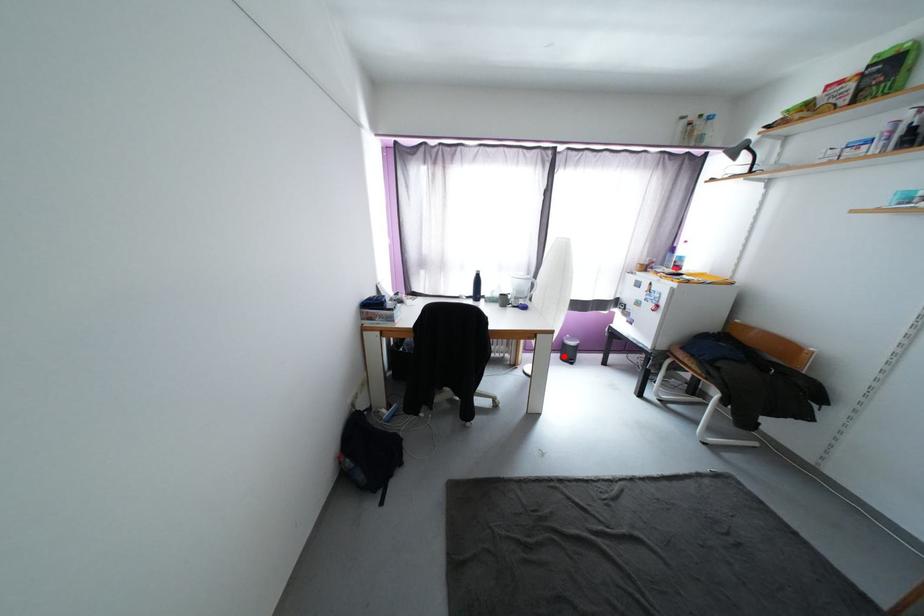
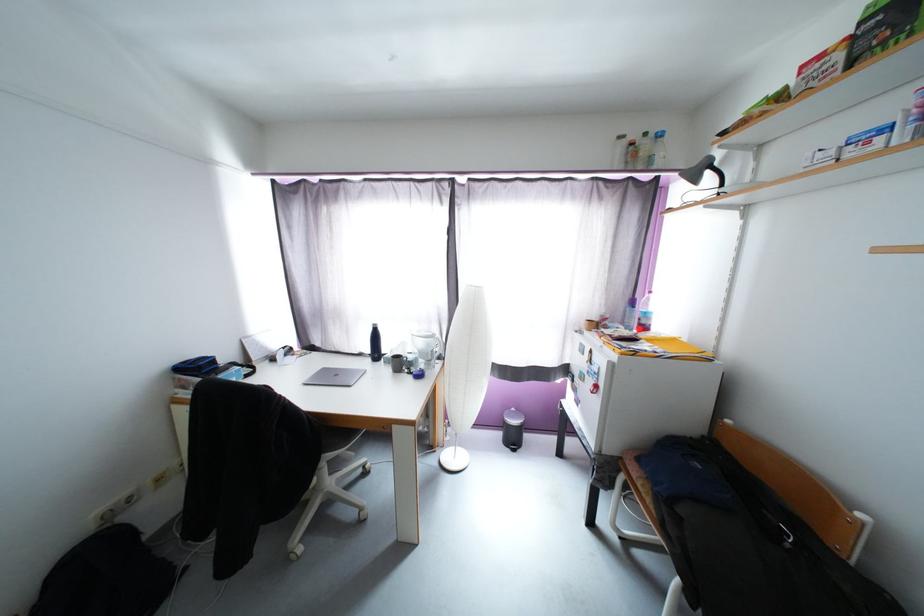
Find the pixel in the second image that matches the highlighted location in the first image.

(505, 437)